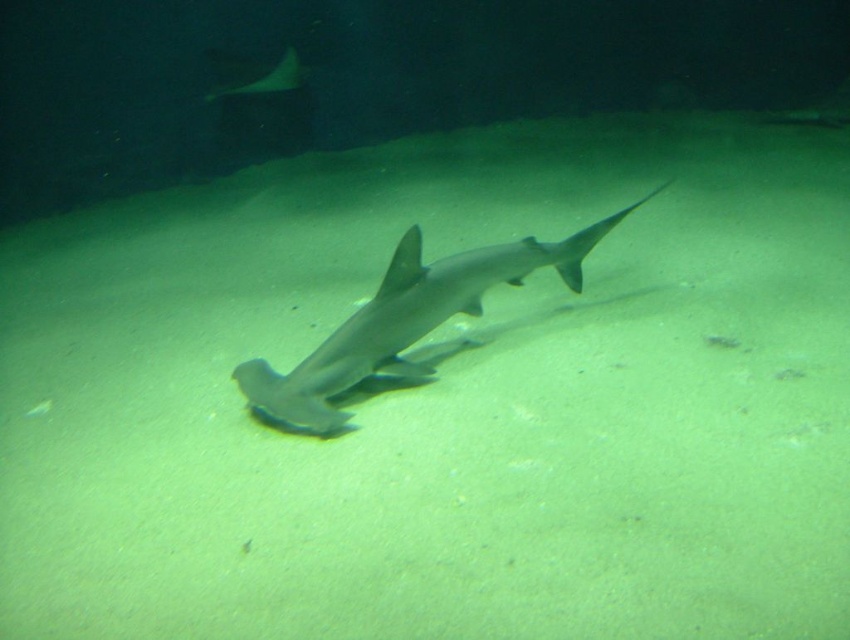
Question: Does gray matte shark at center have a smaller size compared to smooth gray stingray at upper center?

Choices:
 (A) no
 (B) yes

Answer: (A)

Question: Is gray matte shark at center smaller than smooth gray stingray at upper center?

Choices:
 (A) yes
 (B) no

Answer: (B)

Question: Does gray matte shark at center appear under smooth gray stingray at upper center?

Choices:
 (A) yes
 (B) no

Answer: (A)

Question: Which of the following is the closest to the observer?

Choices:
 (A) gray matte shark at center
 (B) smooth gray stingray at upper center

Answer: (A)